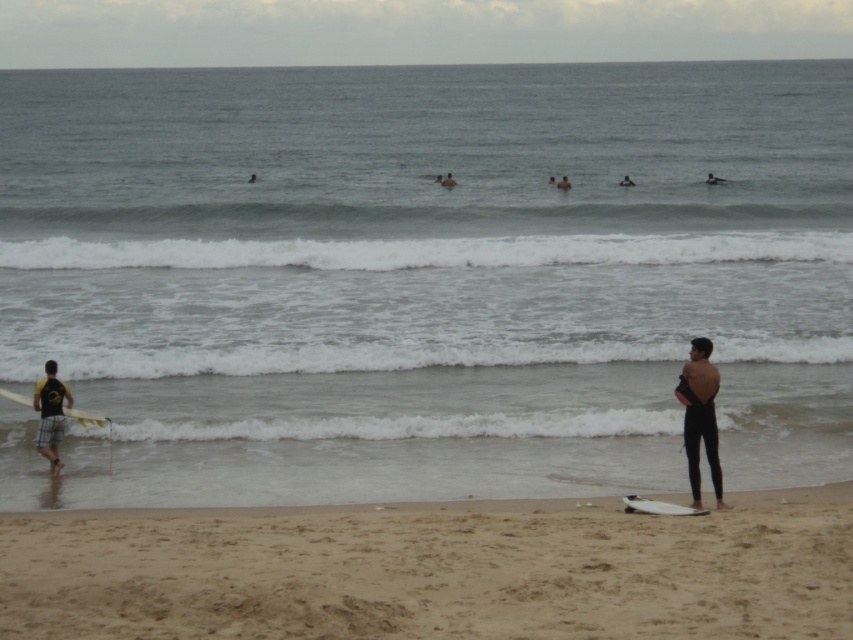
You are a surfer who just arrived at the beach. You see the clear water at surfboard right and the white matte surfboard at left. Which one is bigger?

The clear water at surfboard right is larger in size than the white matte surfboard at left.